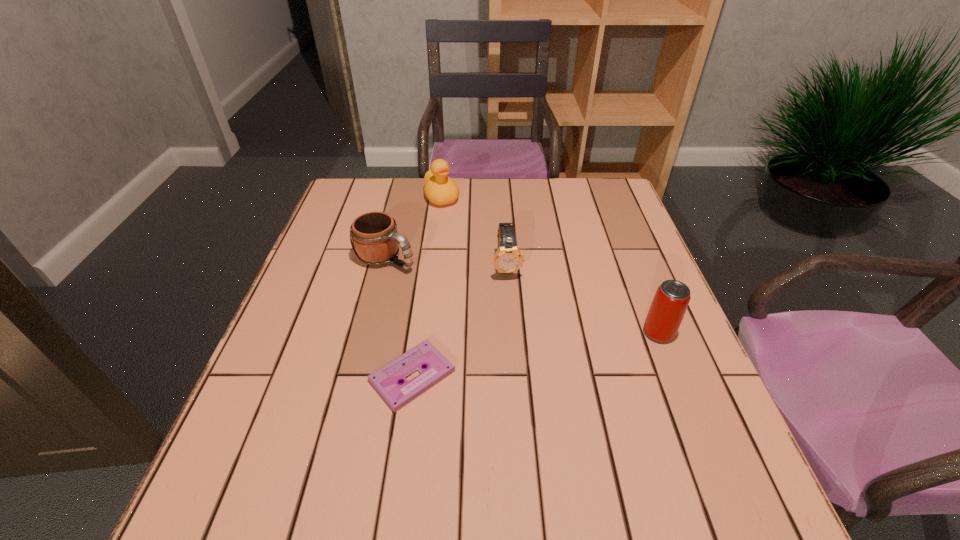
Image resolution: width=960 pixels, height=540 pixels. I want to click on vacant space at the left edge of the desktop, so click(341, 301).

You are a GUI agent. You are given a task and a screenshot of the screen. Output one action in this format:
    pyautogui.click(x=<x>, y=<y>)
    Task: Click on the free spot at the right edge of the desktop
    
    Given the screenshot: What is the action you would take?
    pyautogui.click(x=600, y=233)

The height and width of the screenshot is (540, 960). Identify the location of free space at the near left corner of the desktop. (269, 460).

The width and height of the screenshot is (960, 540). Find the location of `empty space between the beer can and the watch`. empty space between the beer can and the watch is located at coordinates (583, 299).

Where is `empty space that is in between the mug and the videotape`? The image size is (960, 540). empty space that is in between the mug and the videotape is located at coordinates (399, 318).

Where is `free space between the second object from right to left and the shortest object`? free space between the second object from right to left and the shortest object is located at coordinates (460, 321).

Locate an element on the screen. This screenshot has height=540, width=960. free space between the videotape and the rightmost object is located at coordinates (536, 354).

I want to click on free area in between the watch and the farthest object, so click(x=474, y=231).

At what (x,y) coordinates should I click in order to perform the action: click on vacant space that's between the mug and the farthest object. Please return your answer as a coordinate pair (x, y). Looking at the image, I should click on (414, 227).

Identify the location of free space between the beer can and the duck. (550, 265).